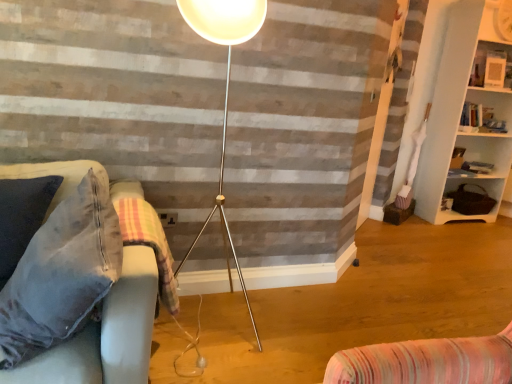
Question: In the image, is wooden textured basket at right, positioned as the 1th shelf in bottom-to-top order, on the left side or the right side of plaid fabric blanket at lower left?

Choices:
 (A) right
 (B) left

Answer: (A)

Question: Choose the correct answer: Is wooden textured basket at right, positioned as the 1th shelf in bottom-to-top order, inside plaid fabric blanket at lower left or outside it?

Choices:
 (A) inside
 (B) outside

Answer: (B)

Question: Considering the real-world distances, which object is closest to the wooden textured basket at right, positioned as the 1th shelf in bottom-to-top order?

Choices:
 (A) white glossy picture frame at upper right, which is counted as the 1th shelf, starting from the top
 (B) white matte bookshelf at right, the 2th shelf from the top
 (C) velvet fabric couch at left
 (D) plaid fabric blanket at lower left

Answer: (B)

Question: Estimate the real-world distances between objects in this image. Which object is closer to the plaid fabric blanket at lower left?

Choices:
 (A) wooden textured basket at right, positioned as the 1th shelf in bottom-to-top order
 (B) velvet fabric couch at left
 (C) white glossy picture frame at upper right, which is counted as the 1th shelf, starting from the top
 (D) white matte bookshelf at right, the second shelf from the bottom

Answer: (B)